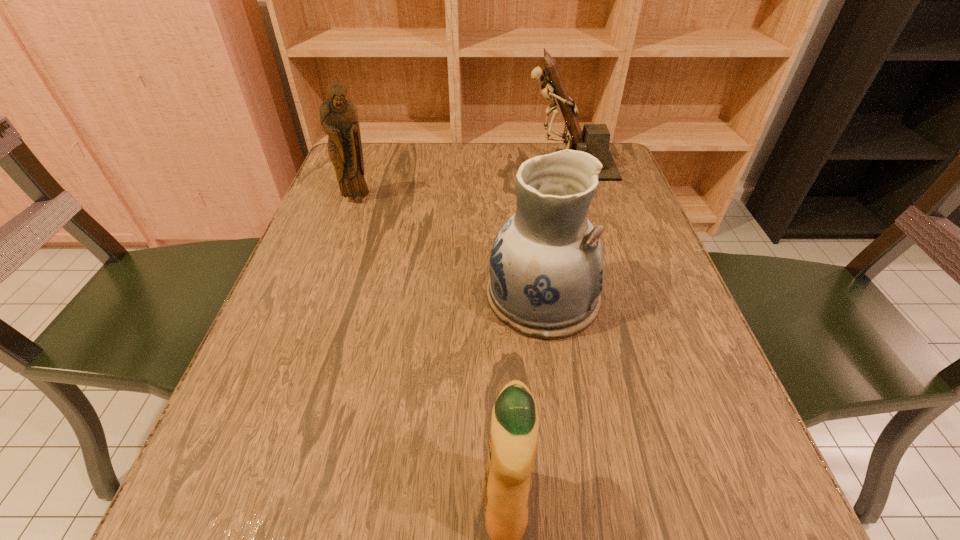
Locate an element on the screen. the farthest object is located at coordinates (594, 139).

This screenshot has width=960, height=540. What are the coordinates of `the farther figurine` in the screenshot? It's located at (594, 139).

Where is `the leftmost object`? The width and height of the screenshot is (960, 540). the leftmost object is located at coordinates (338, 117).

This screenshot has height=540, width=960. I want to click on the left figurine, so click(x=338, y=117).

Identify the location of pottery. (546, 265).

This screenshot has width=960, height=540. What are the coordinates of `vacant space located 0.290m on the front-facing side of the right figurine` in the screenshot? It's located at (415, 165).

Locate an element on the screen. This screenshot has width=960, height=540. free space located 0.220m on the front-facing side of the right figurine is located at coordinates (441, 165).

The image size is (960, 540). Identify the location of vacant space situated on the front-facing side of the right figurine. (460, 165).

Find the location of a particular element. The image size is (960, 540). free space located on the front-facing side of the left figurine is located at coordinates (351, 218).

Locate an element on the screen. This screenshot has height=540, width=960. free space located on the left of the pottery is located at coordinates (331, 296).